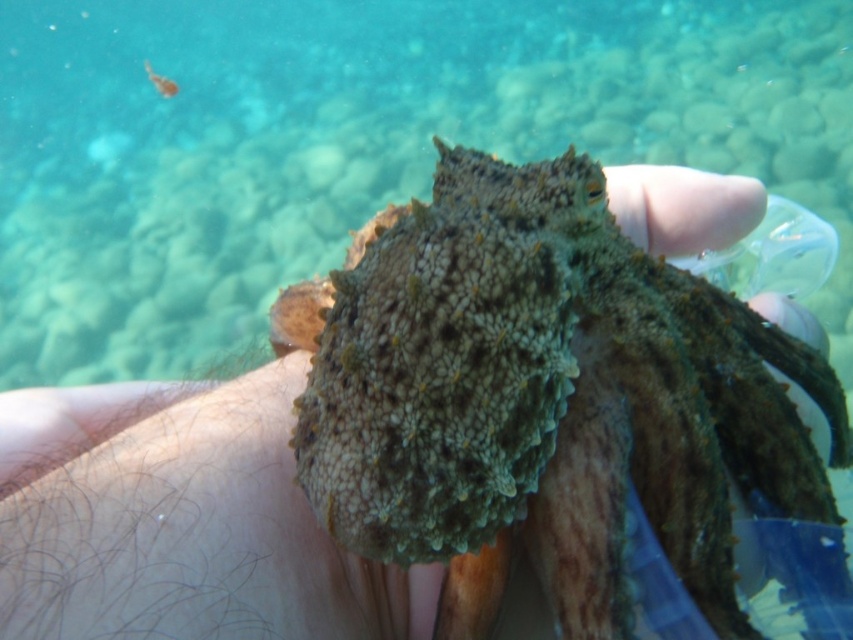
Does hairless skin at lower center appear over translucent orange fish at upper left?

No.

Which is in front, point (171, 586) or point (165, 92)?

Positioned in front is point (171, 586).

Between point (254, 477) and point (163, 83), which one is positioned in front?

Point (254, 477) is more forward.

The height and width of the screenshot is (640, 853). Find the location of `hairless skin at lower center`. hairless skin at lower center is located at coordinates (195, 536).

Can you confirm if camouflage textured octopus at center is bigger than hairless skin at lower center?

Indeed, camouflage textured octopus at center has a larger size compared to hairless skin at lower center.

Is point (808, 436) farther from viewer compared to point (132, 608)?

Yes.

Find the location of a particular element. The image size is (853, 640). camouflage textured octopus at center is located at coordinates (563, 413).

I want to click on camouflage textured octopus at center, so click(563, 413).

Consider the image. Who is taller, camouflage textured octopus at center or translucent orange fish at upper left?

With more height is camouflage textured octopus at center.

This screenshot has width=853, height=640. Identify the location of camouflage textured octopus at center. point(563,413).

Between point (451, 234) and point (160, 81), which one is positioned behind?

Point (160, 81)

Identify the location of camouflage textured octopus at center. (563, 413).